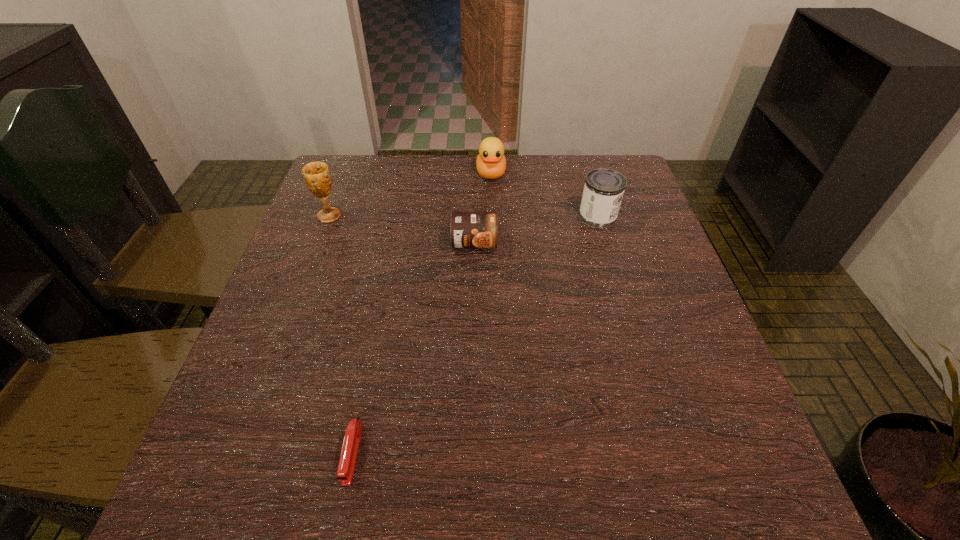
Image resolution: width=960 pixels, height=540 pixels. Find the location of `free spot at the near left corner of the desktop`. free spot at the near left corner of the desktop is located at coordinates (231, 482).

In the image, there is a desktop. Where is `vacant area at the far right corner`? vacant area at the far right corner is located at coordinates (637, 179).

At what (x,y) coordinates should I click in order to perform the action: click on free space between the second shortest object and the nearest object. Please return your answer as a coordinate pair (x, y). The height and width of the screenshot is (540, 960). Looking at the image, I should click on coord(413,348).

Locate an element on the screen. free spot between the fourth tallest object and the taller can is located at coordinates (536, 230).

Where is `vacant area that lies between the chalice and the stapler`? This screenshot has height=540, width=960. vacant area that lies between the chalice and the stapler is located at coordinates (341, 335).

This screenshot has height=540, width=960. I want to click on empty space that is in between the taller can and the left can, so [536, 230].

You are a GUI agent. You are given a task and a screenshot of the screen. Output one action in this format:
    pyautogui.click(x=<x>, y=<y>)
    Task: Click on the blank region between the nearest object and the nearer can
    This screenshot has height=540, width=960.
    Given the screenshot: What is the action you would take?
    pyautogui.click(x=413, y=348)

Identify the location of blank region between the nearer can and the farthest object. This screenshot has height=540, width=960. (483, 208).

Where is `vacant space in between the rightmost object and the duckling`? The height and width of the screenshot is (540, 960). vacant space in between the rightmost object and the duckling is located at coordinates (544, 195).

This screenshot has width=960, height=540. Find the location of `vacant space that is in between the nearest object and the left can`. vacant space that is in between the nearest object and the left can is located at coordinates (413, 348).